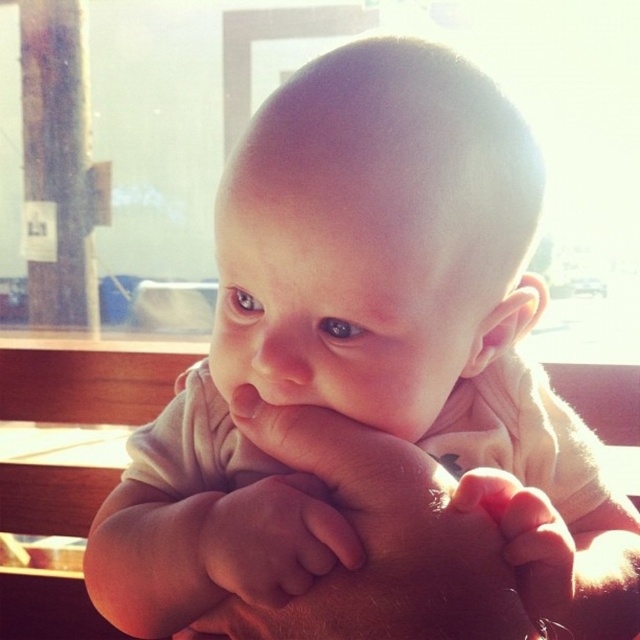
Question: Which point is farther to the camera?

Choices:
 (A) (472, 488)
 (B) (310, 529)

Answer: (B)

Question: Is pink soft skin at center thinner than soft skin hand at lower right?

Choices:
 (A) no
 (B) yes

Answer: (A)

Question: Where is pink soft skin at center located in relation to soft skin hand at lower right in the image?

Choices:
 (A) above
 (B) below

Answer: (A)

Question: Is pink soft skin at center bigger than soft skin hand at lower right?

Choices:
 (A) no
 (B) yes

Answer: (A)